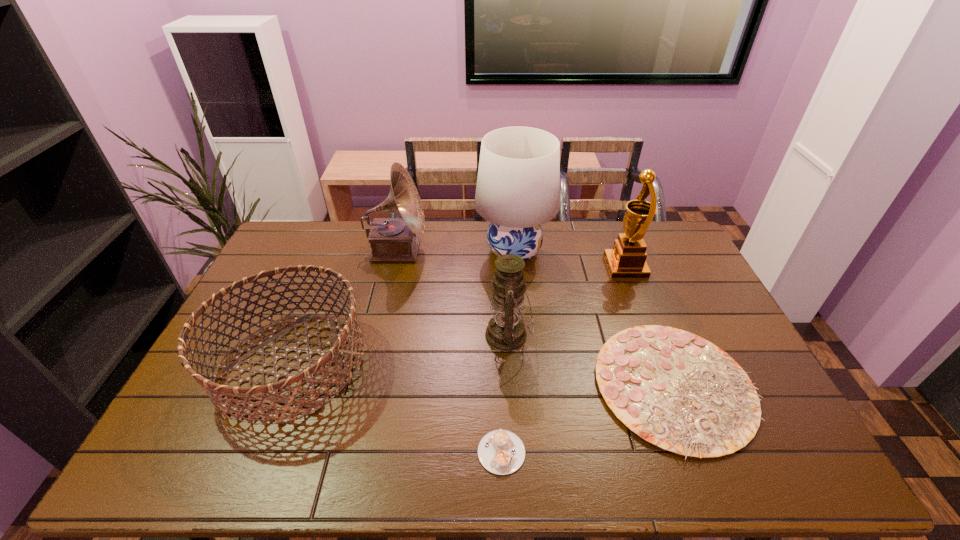
Where is `vacant region that satisfies the following two spatial constraints: 1. on the horn of the oil lamp; 2. on the left side of the phonograph record`? vacant region that satisfies the following two spatial constraints: 1. on the horn of the oil lamp; 2. on the left side of the phonograph record is located at coordinates (377, 335).

Identify the location of free point that satisfies the following two spatial constraints: 1. on the front-facing side of the lampshade; 2. on the front side of the shortest object. The width and height of the screenshot is (960, 540). (533, 452).

I want to click on vacant point that satisfies the following two spatial constraints: 1. on the back side of the sixth tallest object; 2. on the right side of the shortest object, so click(x=499, y=386).

Image resolution: width=960 pixels, height=540 pixels. What are the coordinates of `vacant space that satisfies the following two spatial constraints: 1. on the back side of the fourth tallest object; 2. on the right side of the shortest object` in the screenshot? It's located at (497, 335).

This screenshot has width=960, height=540. Identify the location of vacant space that satisfies the following two spatial constraints: 1. on the horn of the phonograph record; 2. on the right side of the cappuccino. (350, 452).

Where is `free space that satisfies the following two spatial constraints: 1. on the back side of the cappuccino; 2. on the horn of the phonograph record`? free space that satisfies the following two spatial constraints: 1. on the back side of the cappuccino; 2. on the horn of the phonograph record is located at coordinates (493, 251).

Find the location of a particular element. The height and width of the screenshot is (540, 960). vacant space that satisfies the following two spatial constraints: 1. on the horn of the cappuccino; 2. on the right side of the phonograph record is located at coordinates coord(350,452).